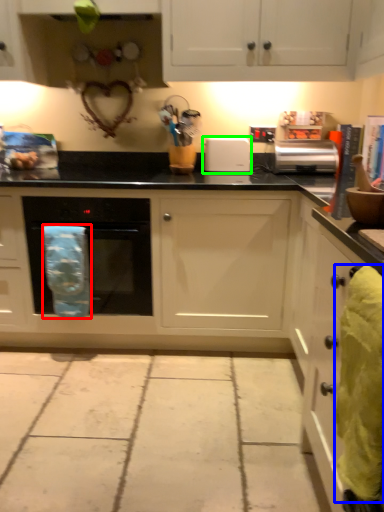
Question: Which is farther away from material (highlighted by a red box)? material (highlighted by a blue box) or appliance (highlighted by a green box)?

Choices:
 (A) material
 (B) appliance

Answer: (A)